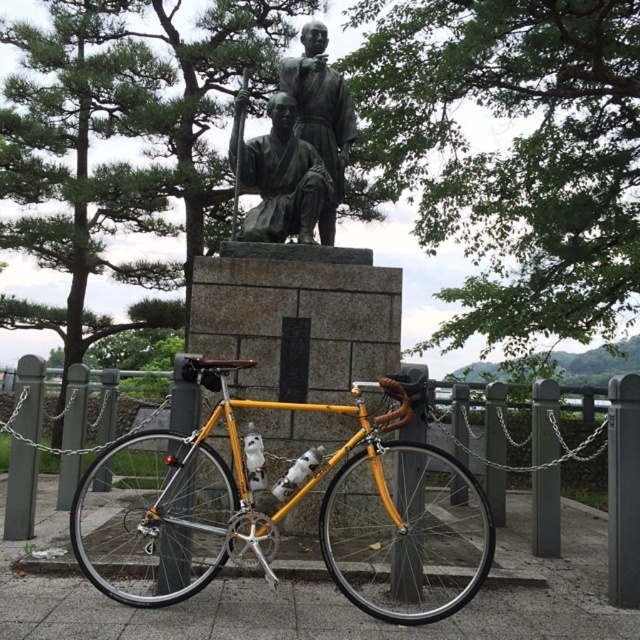
Is yellow metallic bicycle at center closer to the viewer compared to bronze statue at center?

Yes, yellow metallic bicycle at center is in front of bronze statue at center.

Measure the distance between yellow metallic bicycle at center and bronze statue at center.

1.79 meters

Who is more forward, (422, 513) or (268, 224)?

Point (422, 513) is more forward.

You are a GUI agent. You are given a task and a screenshot of the screen. Output one action in this format:
    pyautogui.click(x=<x>, y=<y>)
    Task: Click on the yellow metallic bicycle at center
    This screenshot has width=640, height=640.
    Given the screenshot: What is the action you would take?
    pyautogui.click(x=291, y=508)

Image resolution: width=640 pixels, height=640 pixels. Describe the element at coordinates (278, 176) in the screenshot. I see `bronze statue at center` at that location.

I want to click on bronze statue at center, so click(278, 176).

Between yellow metallic bicycle at center and bronze statue at upper center, which one has more height?

bronze statue at upper center is taller.

Is yellow metallic bicycle at center below bronze statue at upper center?

Indeed, yellow metallic bicycle at center is positioned under bronze statue at upper center.

Is point (433, 513) less distant than point (323, 42)?

That is False.

In order to click on yellow metallic bicycle at center in this screenshot , I will do `click(291, 508)`.